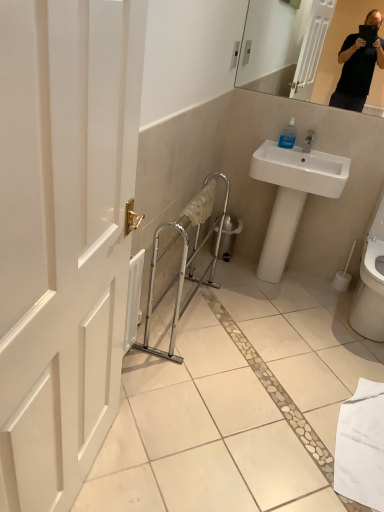
Question: From the image's perspective, is transparent plastic soap dispenser at upper right located beneath white glossy sink at upper right?

Choices:
 (A) yes
 (B) no

Answer: (B)

Question: From the image's perspective, is transparent plastic soap dispenser at upper right above white glossy sink at upper right?

Choices:
 (A) yes
 (B) no

Answer: (A)

Question: Is transparent plastic soap dispenser at upper right bigger than white glossy sink at upper right?

Choices:
 (A) no
 (B) yes

Answer: (A)

Question: Would you say transparent plastic soap dispenser at upper right is outside white glossy sink at upper right?

Choices:
 (A) no
 (B) yes

Answer: (A)

Question: Considering the relative sizes of transparent plastic soap dispenser at upper right and white glossy sink at upper right in the image provided, is transparent plastic soap dispenser at upper right smaller than white glossy sink at upper right?

Choices:
 (A) yes
 (B) no

Answer: (A)

Question: Is transparent plastic soap dispenser at upper right to the left or to the right of white glossy toilet at lower right in the image?

Choices:
 (A) left
 (B) right

Answer: (A)

Question: Considering their positions, is transparent plastic soap dispenser at upper right located in front of or behind white glossy toilet at lower right?

Choices:
 (A) front
 (B) behind

Answer: (B)

Question: Is transparent plastic soap dispenser at upper right taller or shorter than white glossy toilet at lower right?

Choices:
 (A) tall
 (B) short

Answer: (B)

Question: In terms of size, does transparent plastic soap dispenser at upper right appear bigger or smaller than white glossy toilet at lower right?

Choices:
 (A) big
 (B) small

Answer: (B)

Question: From a real-world perspective, relative to white glossy sink at upper right, is white glossy toilet at lower right vertically above or below?

Choices:
 (A) below
 (B) above

Answer: (A)

Question: From the image's perspective, is white glossy toilet at lower right above or below white glossy sink at upper right?

Choices:
 (A) above
 (B) below

Answer: (B)

Question: Which is correct: white glossy toilet at lower right is inside white glossy sink at upper right, or outside of it?

Choices:
 (A) inside
 (B) outside

Answer: (B)

Question: Relative to white glossy sink at upper right, is white glossy toilet at lower right in front or behind?

Choices:
 (A) front
 (B) behind

Answer: (A)

Question: Considering their positions, is white glossy sink at upper right located in front of or behind white glossy toilet at lower right?

Choices:
 (A) behind
 (B) front

Answer: (A)

Question: Choose the correct answer: Is white glossy sink at upper right inside white glossy toilet at lower right or outside it?

Choices:
 (A) inside
 (B) outside

Answer: (B)